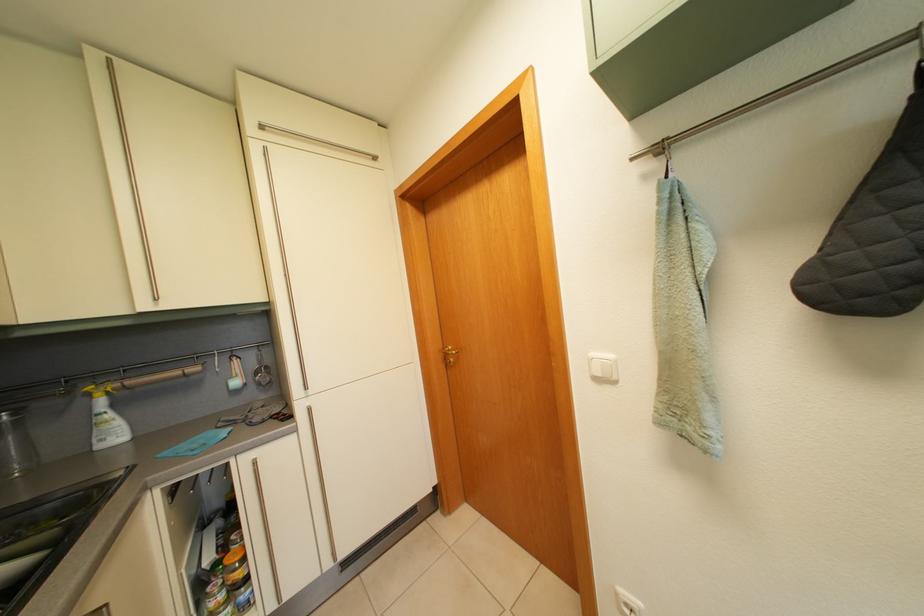
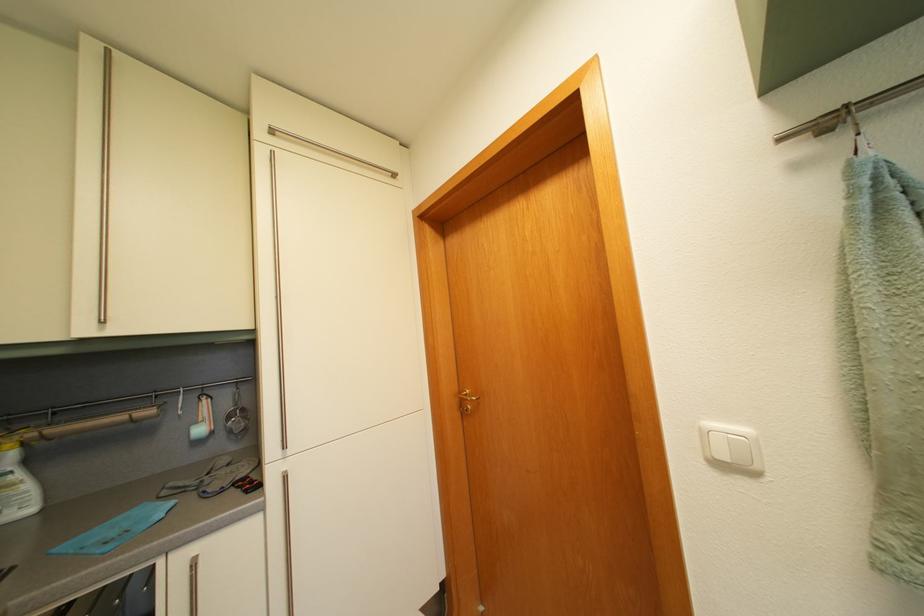
Locate, in the second image, the point that corresponds to [448,354] in the first image.

(465, 397)